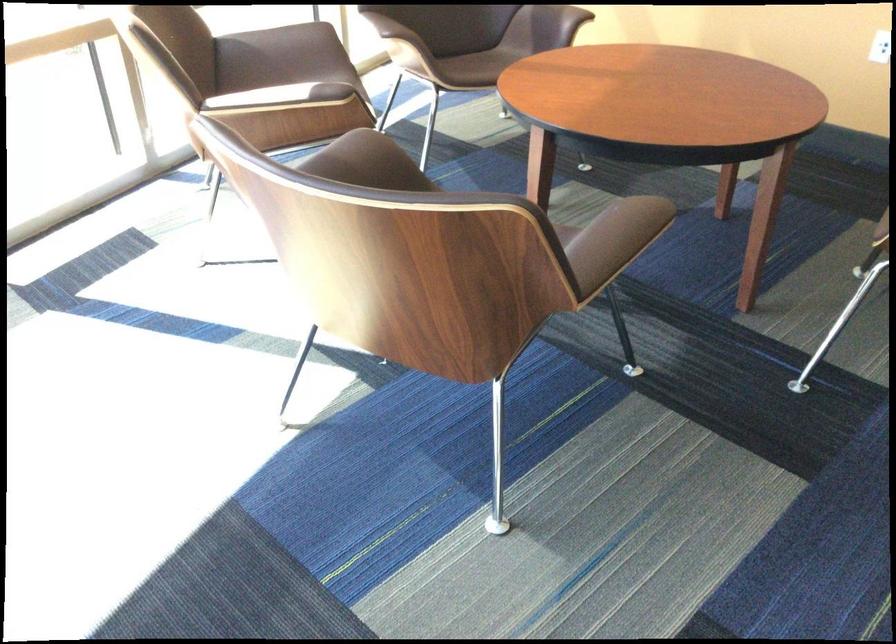
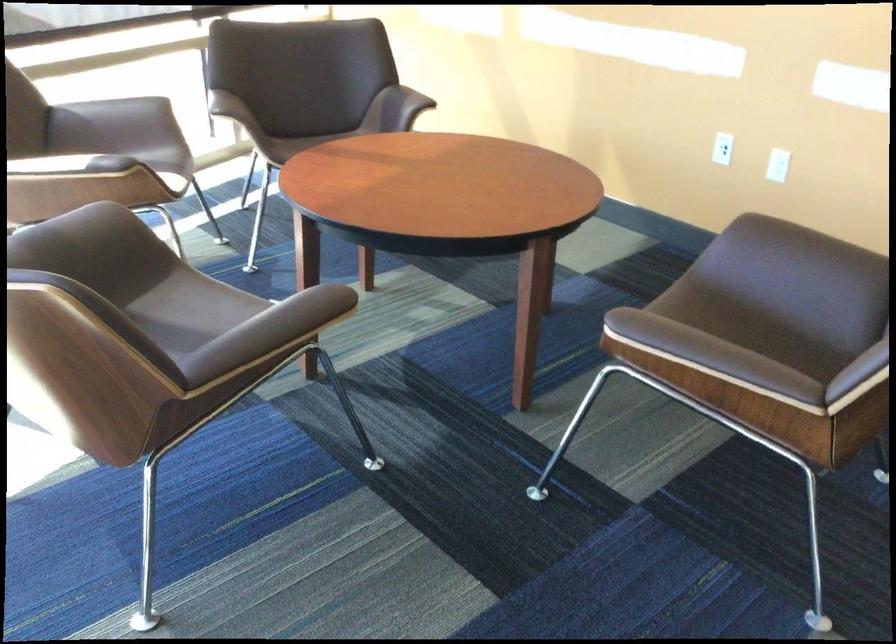
Question: How did the camera likely rotate?

Choices:
 (A) Left
 (B) Right
 (C) Up
 (D) Down

Answer: (C)